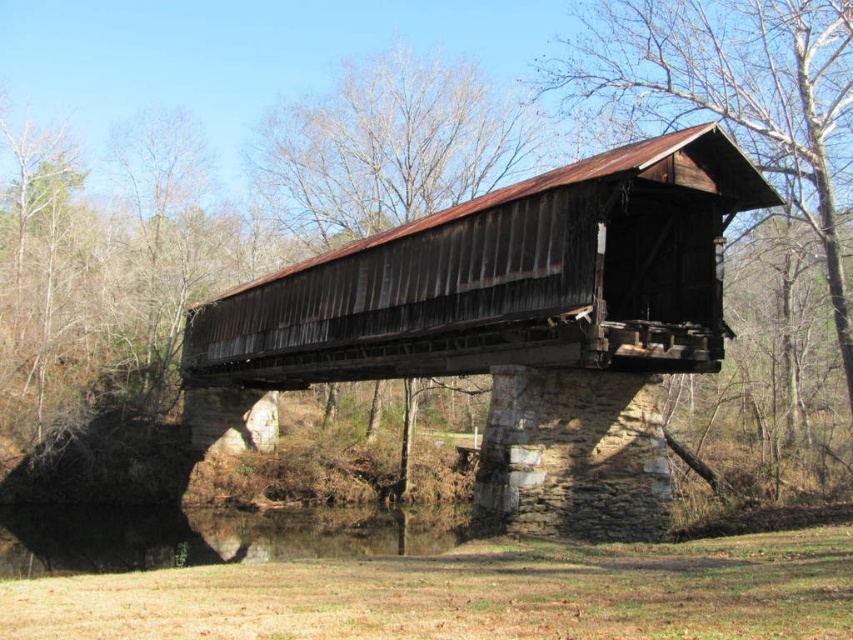
You are standing on the rustic covered bridge and want to determine which of the two points, point (350, 344) or point (62, 540), is nearer to you. Based on the scene description, which point is closer?

Point (350, 344) is closer to the viewer than point (62, 540).

You are standing at the entrance of the rustic covered bridge and want to cross to the other side. Based on the coordinates provided in the Objects Description, is the rusty metal bridge at center positioned directly in front of you or to one side?

The rusty metal bridge at center is located at coordinates point (515, 323), which places it directly in front of you since it is centered both horizontally and vertically in the scene.